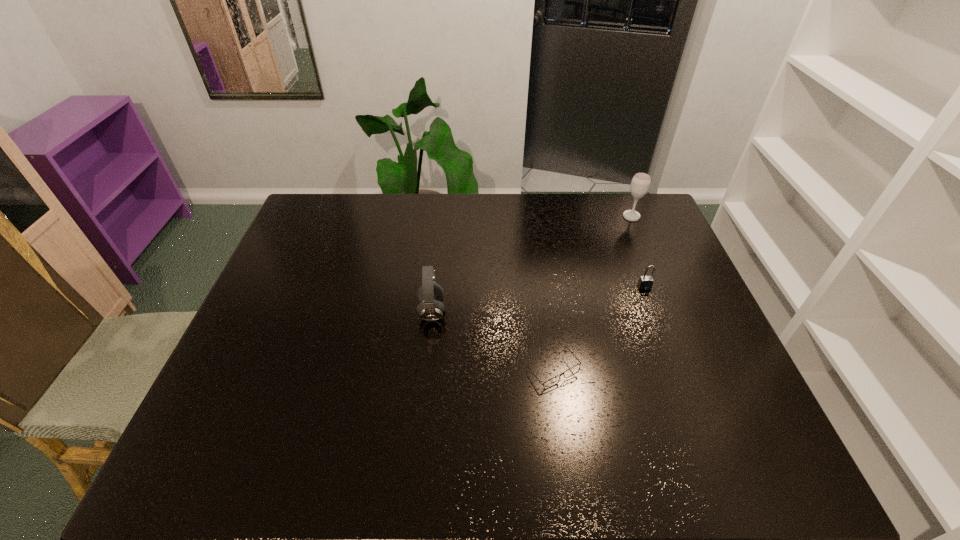
At what (x,y) coordinates should I click in order to perform the action: click on wineglass. Please return your answer as a coordinate pair (x, y). This screenshot has height=540, width=960. Looking at the image, I should click on (640, 184).

I want to click on the second nearest object, so click(430, 294).

The width and height of the screenshot is (960, 540). Identify the location of headset. 430,294.

Where is `the second farthest object`? The image size is (960, 540). the second farthest object is located at coordinates (645, 282).

Where is `padlock`? This screenshot has height=540, width=960. padlock is located at coordinates (645, 282).

Locate an element on the screen. the shortest object is located at coordinates (573, 370).

Locate an element on the screen. the second object from left to right is located at coordinates (573, 370).

The image size is (960, 540). Identify the location of vacant space situated on the front of the wineglass. (655, 273).

Find the location of a particular element. This screenshot has height=540, width=960. free space located 0.380m on the ear cups of the headset is located at coordinates (583, 311).

Locate an element on the screen. Image resolution: width=960 pixels, height=540 pixels. free region located 0.300m on the shackle of the second farthest object is located at coordinates (679, 378).